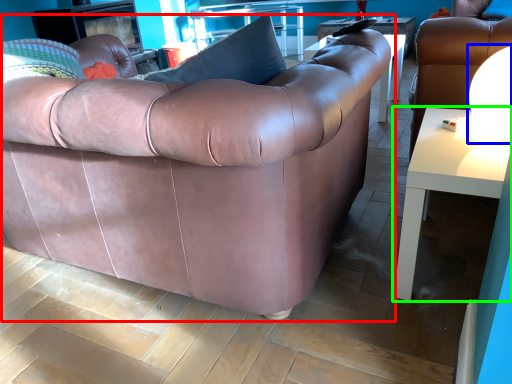
Question: Which object is the farthest from studio couch (highlighted by a red box)? Choose among these: lamp (highlighted by a blue box) or table (highlighted by a green box).

Choices:
 (A) lamp
 (B) table

Answer: (A)